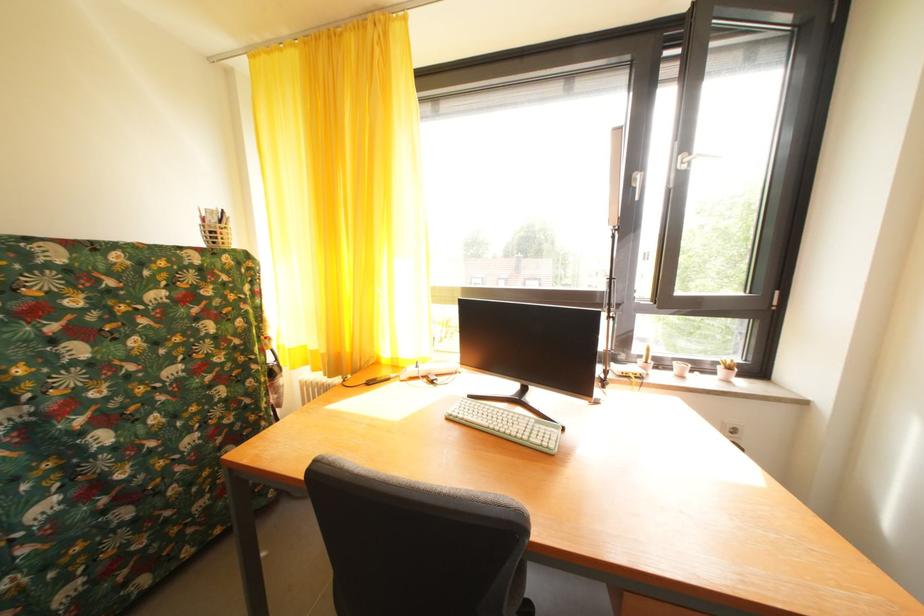
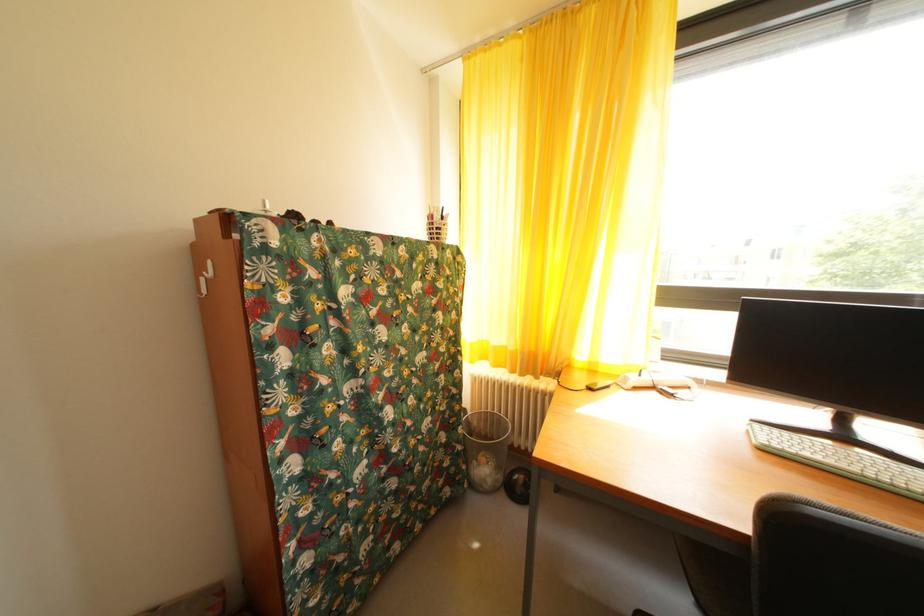
Question: What movement of the cameraman would produce the second image?

Choices:
 (A) Left
 (B) Right
 (C) Forward
 (D) Backward

Answer: (A)